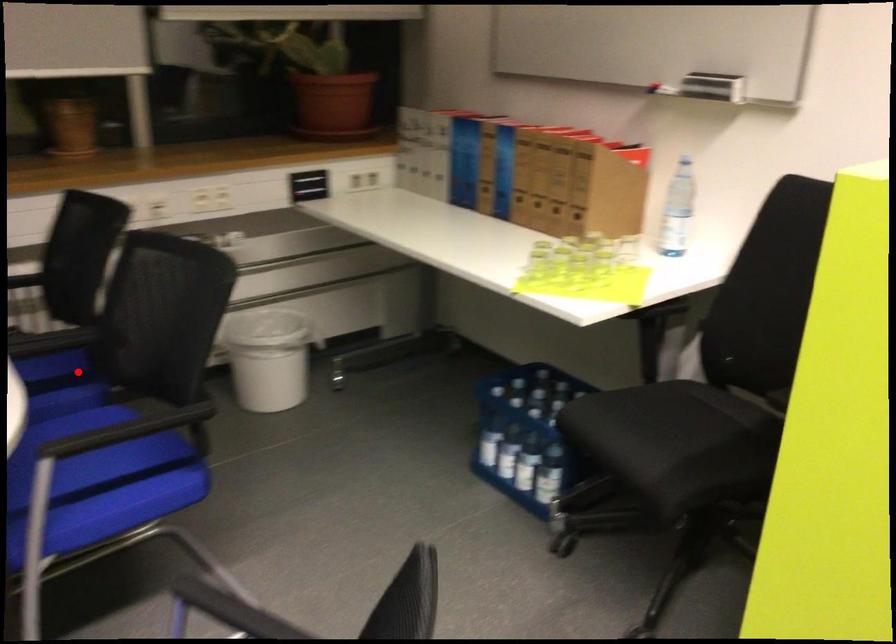
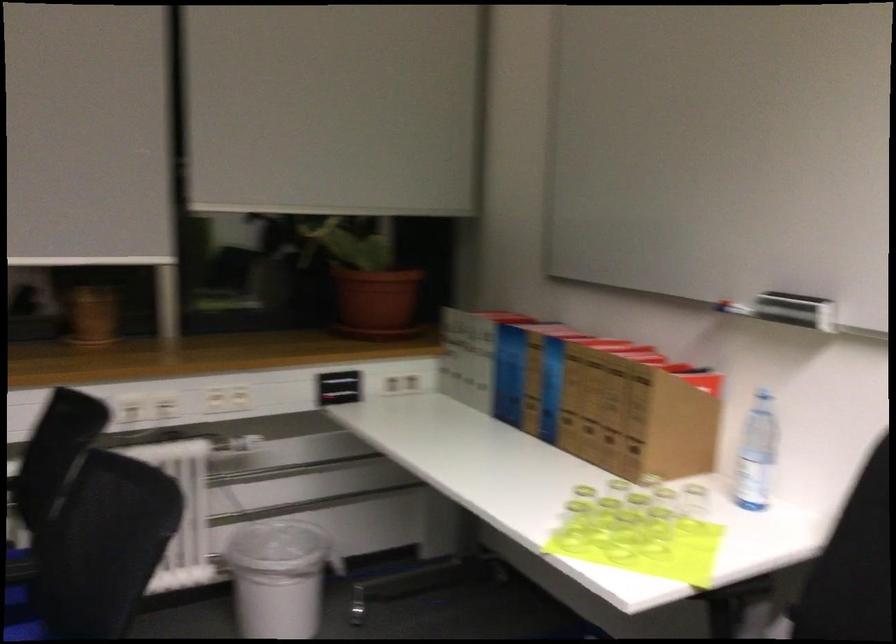
Question: I am providing you with two images of the same scene from different viewpoints. A red point is marked on the first image. Can you still see the location of the red point in image 2?

Choices:
 (A) Yes
 (B) No

Answer: (A)